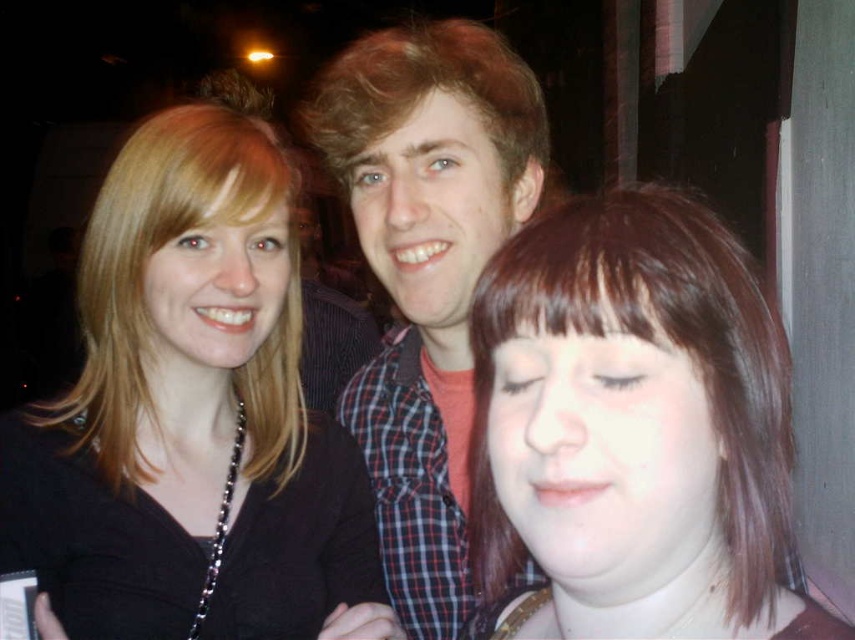
You are trying to decide which of the two people in the photo is shorter. You see the matte black shirt at left and the plaid shirt at center. Which one is shorter?

The matte black shirt at left is not as tall as plaid shirt at center, so the person wearing the matte black shirt at left is shorter.

You are taking a photo of three people standing in a line. You notice two points in the image labeled as point (535, 198) and point (358, 60). Which point is closer to the camera?

Point (535, 198) is further to the camera than point (358, 60), so the point closer to the camera is point (358, 60).